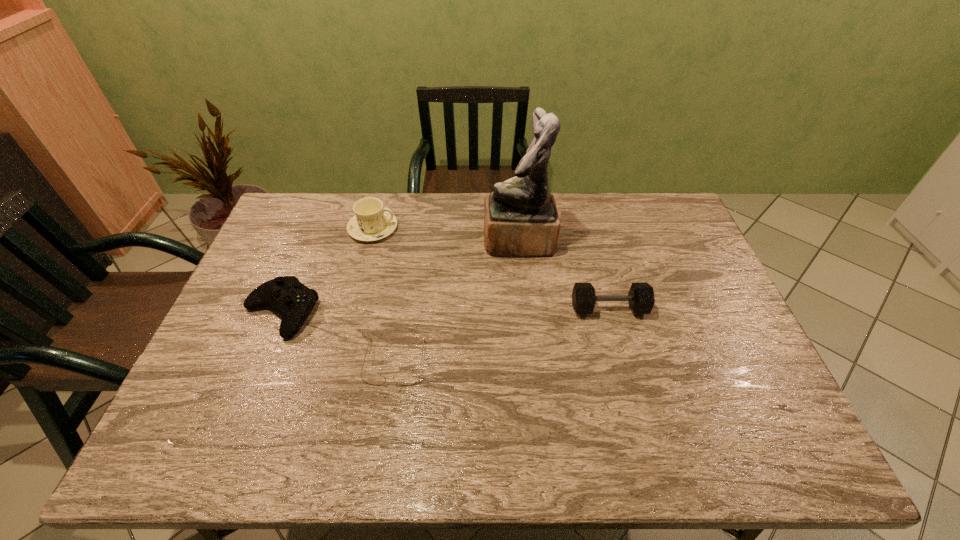
Locate an element on the screen. the tallest object is located at coordinates (521, 219).

Where is `sculpture`? sculpture is located at coordinates (521, 219).

Locate an element on the screen. chinaware is located at coordinates (372, 221).

You are a GUI agent. You are given a task and a screenshot of the screen. Output one action in this format:
    pyautogui.click(x=<x>, y=<y>)
    Task: Click on the dumbbell
    
    Given the screenshot: What is the action you would take?
    pyautogui.click(x=641, y=299)

Locate an element on the screen. control is located at coordinates (294, 301).

Locate an element on the screen. The height and width of the screenshot is (540, 960). the second shortest object is located at coordinates (294, 301).

Identify the location of the shortest object. Image resolution: width=960 pixels, height=540 pixels. (408, 378).

The image size is (960, 540). Find the location of `vacant area located 0.360m in a relaxed pose on the sculpture`. vacant area located 0.360m in a relaxed pose on the sculpture is located at coordinates (377, 241).

Identify the location of blank space located in a relaxed pose on the sculpture. (463, 241).

In order to click on vacant space located 0.350m in a relaxed pose on the sculpture in this screenshot , I will do `click(380, 241)`.